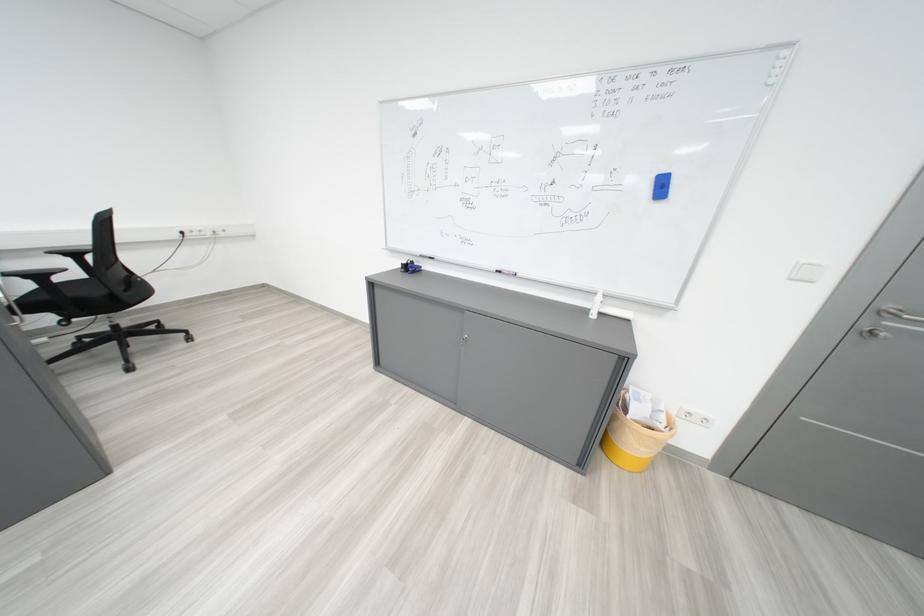
You are a GUI agent. You are given a task and a screenshot of the screen. Output one action in this format:
    pyautogui.click(x=<x>, y=<y>)
    Task: Click on the black chair armrest
    
    Given the screenshot: What is the action you would take?
    pyautogui.click(x=69, y=249)